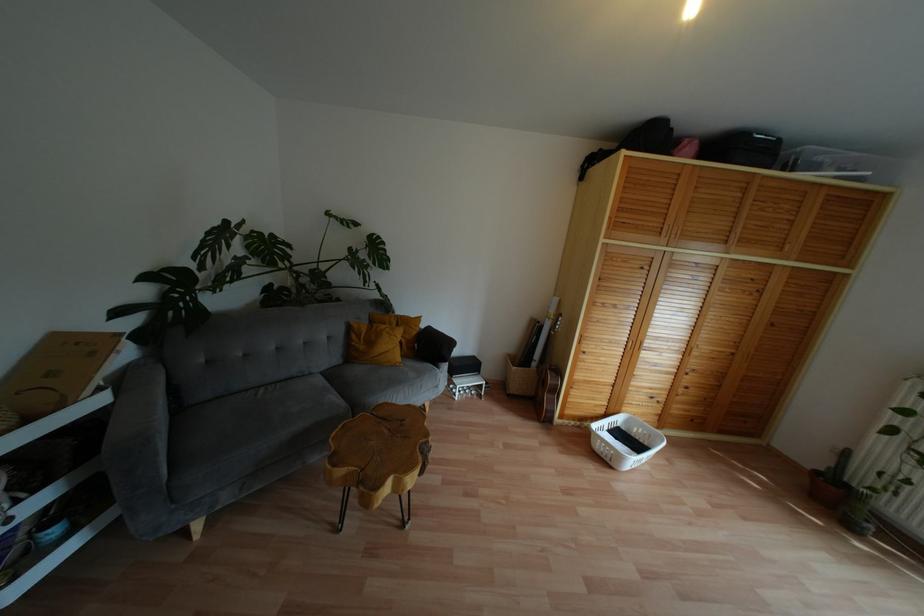
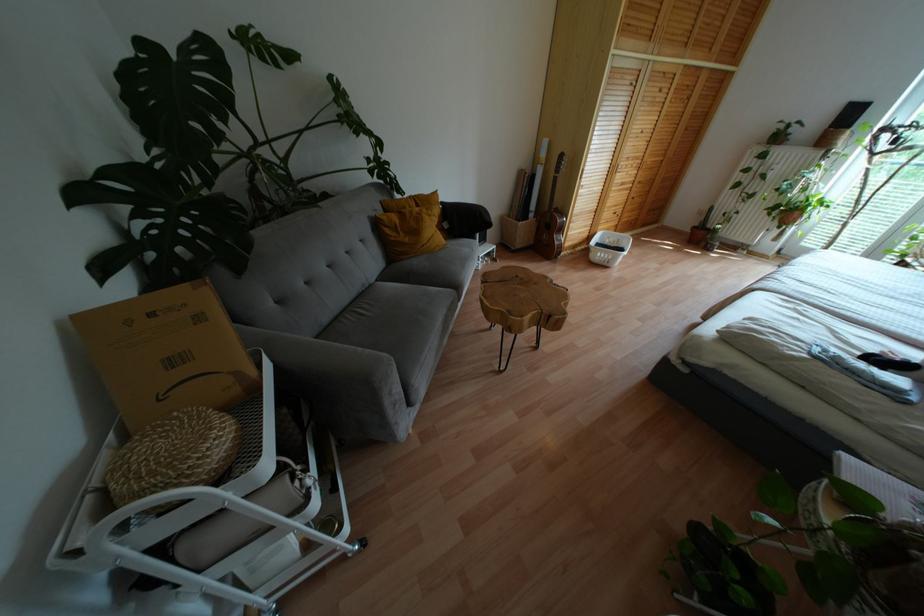
Find the pixel in the second image that matches point (397, 359) in the first image.

(443, 240)